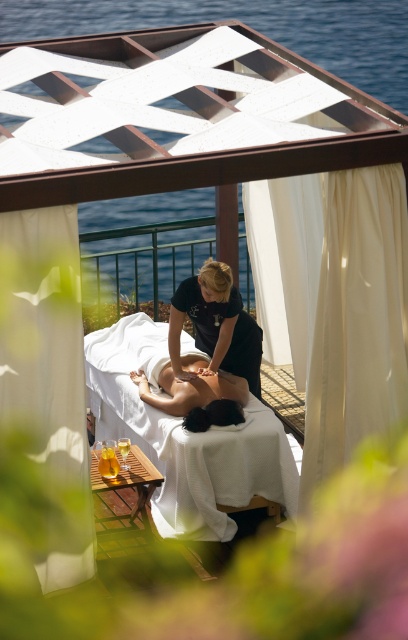
Is white silk curtain at right further to the viewer compared to white smooth bed at center?

No, white silk curtain at right is in front of white smooth bed at center.

Consider the image. Between white silk curtain at right and white smooth bed at center, which one has less height?

white smooth bed at center is shorter.

Does point (390, 321) come closer to viewer compared to point (137, 403)?

That is True.

The image size is (408, 640). Find the location of `white silk curtain at right`. white silk curtain at right is located at coordinates (357, 320).

Is white sheer curtain at left bigger than smooth skin at center?

Correct, white sheer curtain at left is larger in size than smooth skin at center.

Is white sheer curtain at left thinner than smooth skin at center?

Indeed, white sheer curtain at left has a lesser width compared to smooth skin at center.

Which is in front, point (82, 449) or point (217, 371)?

Point (82, 449) is more forward.

Identify the location of white sheer curtain at left. The width and height of the screenshot is (408, 640). (44, 336).

Which is more to the right, white sheer curtain at left or black smooth uniform at center?

Positioned to the right is black smooth uniform at center.

Is white sheer curtain at left taller than black smooth uniform at center?

Correct, white sheer curtain at left is much taller as black smooth uniform at center.

Does point (4, 237) come behind point (239, 321)?

No, it is in front of (239, 321).

This screenshot has width=408, height=640. I want to click on white sheer curtain at left, so click(x=44, y=336).